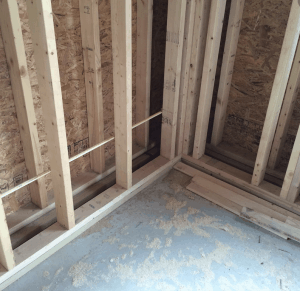
Locate an element on the screen. The width and height of the screenshot is (300, 291). subfloor is located at coordinates (183, 247).